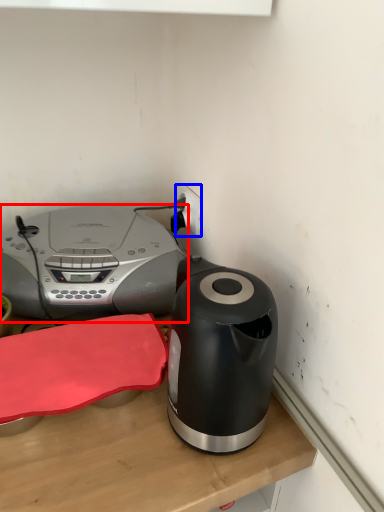
Question: Among these objects, which one is nearest to the camera, home appliance (highlighted by a red box) or electric outlet (highlighted by a blue box)?

Choices:
 (A) home appliance
 (B) electric outlet

Answer: (A)